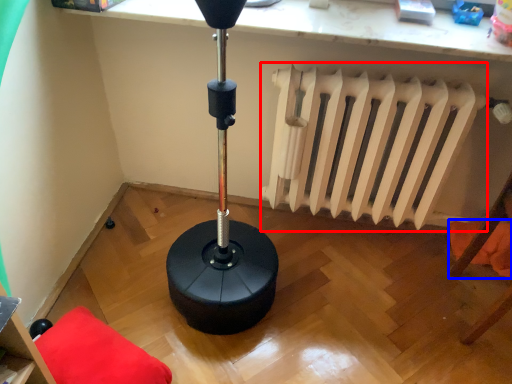
Question: Which object is further to the camera taking this photo, radiator (highlighted by a red box) or pillow (highlighted by a blue box)?

Choices:
 (A) radiator
 (B) pillow

Answer: (B)